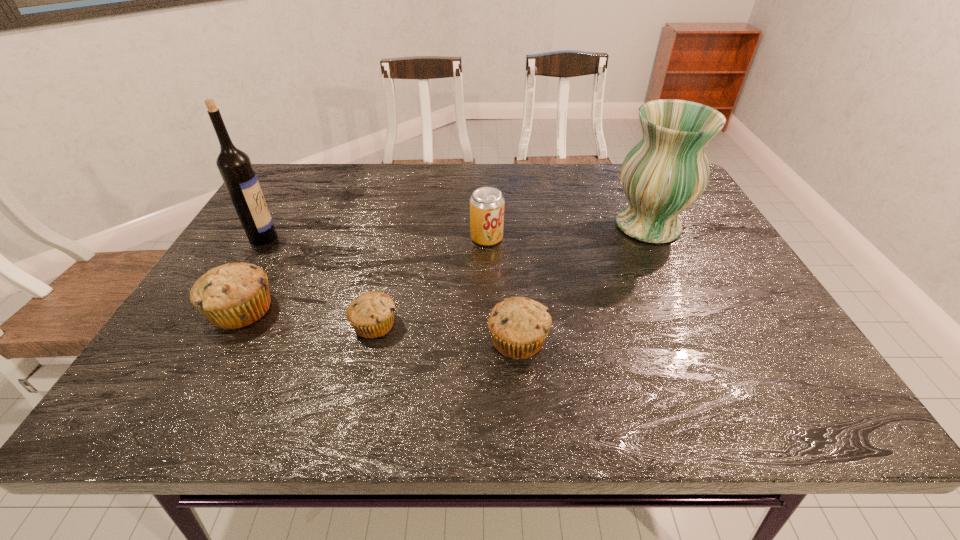
The image size is (960, 540). In order to click on vacant region that satisfies the following two spatial constraints: 1. on the label of the wine bottle; 2. on the right side of the pop (soda) in this screenshot , I will do `click(263, 238)`.

You are a GUI agent. You are given a task and a screenshot of the screen. Output one action in this format:
    pyautogui.click(x=<x>, y=<y>)
    Task: Click on the vacant space that satisfies the following two spatial constraints: 1. on the label of the leftmost muffin; 2. on the left side of the wine bottle
    
    Given the screenshot: What is the action you would take?
    pyautogui.click(x=220, y=310)

Identify the location of free location that satisfies the following two spatial constraints: 1. on the label of the shortest muffin; 2. on the left side of the wine bottle. The width and height of the screenshot is (960, 540). point(210,325).

Locate an element on the screen. vacant space that satisfies the following two spatial constraints: 1. on the label of the wine bottle; 2. on the left side of the third object from left to right is located at coordinates (210, 325).